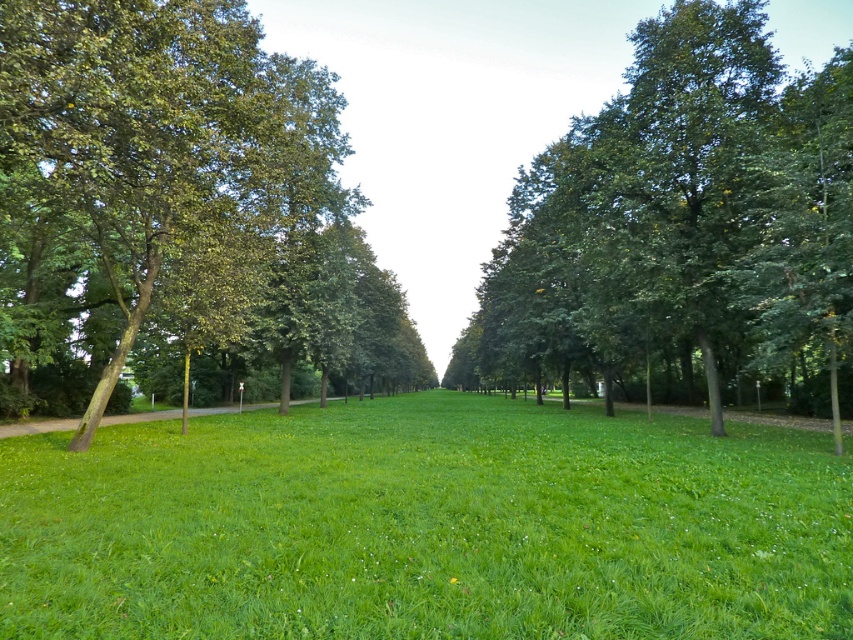
Question: Based on their relative distances, which object is nearer to the green leafy tree at center?

Choices:
 (A) green grass at center
 (B) green grassy field at center

Answer: (B)

Question: Which of the following is the farthest from the observer?

Choices:
 (A) green leafy tree at left
 (B) green grass at center

Answer: (B)

Question: Which point is closer to the camera?

Choices:
 (A) [656, 212]
 (B) [57, 572]
 (C) [38, 275]

Answer: (B)

Question: From the image, what is the correct spatial relationship of green leafy tree at left in relation to green grass at center?

Choices:
 (A) right
 (B) left

Answer: (A)

Question: From the image, what is the correct spatial relationship of green leafy tree at left in relation to green leafy tree at center?

Choices:
 (A) above
 (B) below

Answer: (A)

Question: Does green grassy field at center appear on the left side of green leafy tree at left?

Choices:
 (A) yes
 (B) no

Answer: (B)